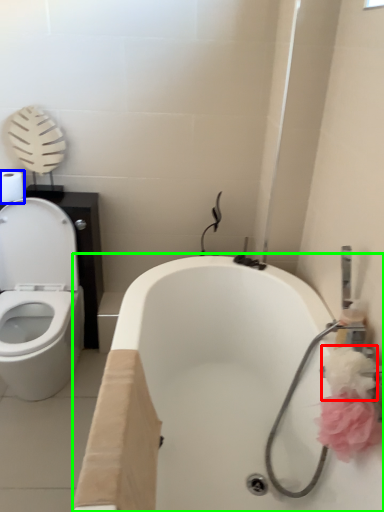
Question: Considering the real-world distances, which object is farthest from flower (highlighted by a red box)? toilet paper (highlighted by a blue box) or bath (highlighted by a green box)?

Choices:
 (A) toilet paper
 (B) bath

Answer: (A)